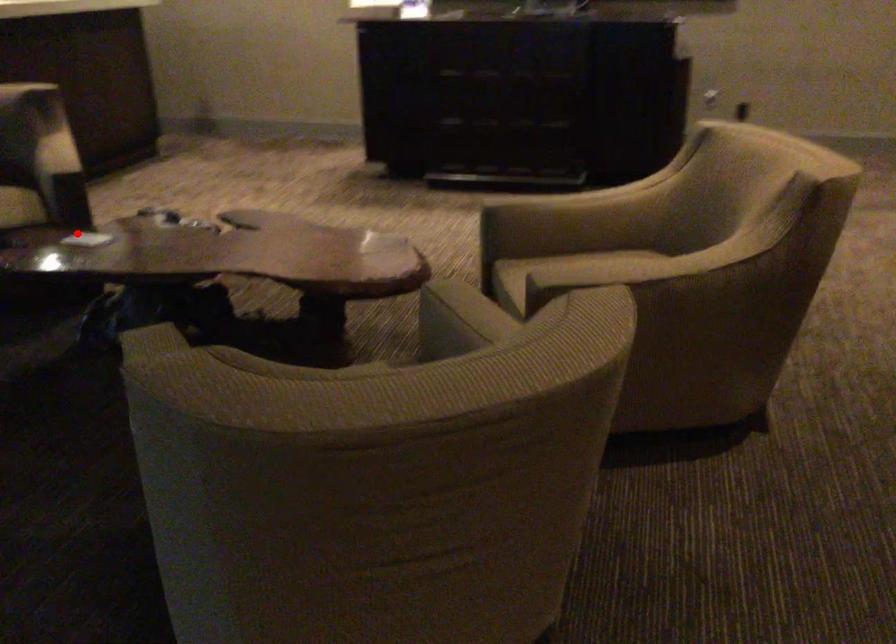
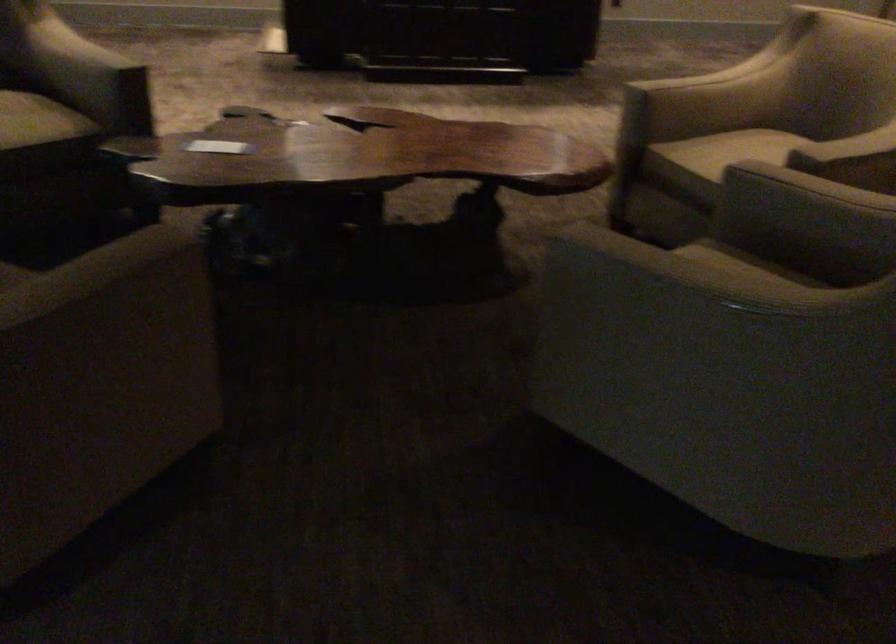
Question: I am providing you with two images of the same scene from different viewpoints. Given a red point in image1, look at the same physical point in image2. Is it:

Choices:
 (A) Closer to the viewpoint
 (B) Farther from the viewpoint

Answer: (A)